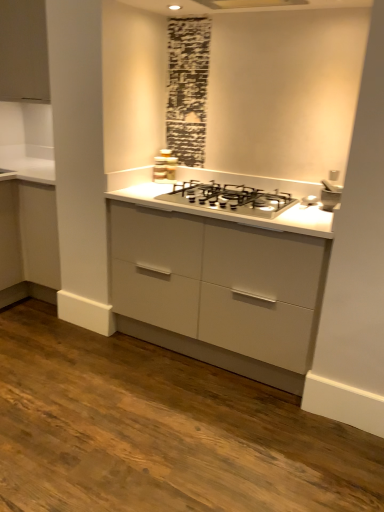
Question: Should I look upward or downward to see matte white cabinet at upper left?

Choices:
 (A) down
 (B) up

Answer: (B)

Question: Is satin silver gas stove at center with satin silver stove at center?

Choices:
 (A) yes
 (B) no

Answer: (B)

Question: From a real-world perspective, does satin silver gas stove at center sit lower than satin silver stove at center?

Choices:
 (A) yes
 (B) no

Answer: (A)

Question: Does satin silver gas stove at center have a larger size compared to satin silver stove at center?

Choices:
 (A) yes
 (B) no

Answer: (A)

Question: From a real-world perspective, is satin silver gas stove at center on satin silver stove at center?

Choices:
 (A) yes
 (B) no

Answer: (B)

Question: Is satin silver gas stove at center at the left side of satin silver stove at center?

Choices:
 (A) no
 (B) yes

Answer: (A)

Question: Is satin silver gas stove at center at the right side of satin silver stove at center?

Choices:
 (A) no
 (B) yes

Answer: (B)

Question: Considering the relative sizes of white ceramic sink at upper right and satin silver stove at center in the image provided, is white ceramic sink at upper right thinner than satin silver stove at center?

Choices:
 (A) no
 (B) yes

Answer: (A)

Question: Is white ceramic sink at upper right at the right side of satin silver stove at center?

Choices:
 (A) no
 (B) yes

Answer: (B)

Question: Is white ceramic sink at upper right outside satin silver stove at center?

Choices:
 (A) no
 (B) yes

Answer: (B)

Question: Could satin silver stove at center be considered to be inside white ceramic sink at upper right?

Choices:
 (A) no
 (B) yes

Answer: (A)

Question: From a real-world perspective, is white ceramic sink at upper right over satin silver stove at center?

Choices:
 (A) no
 (B) yes

Answer: (A)

Question: Is white ceramic sink at upper right taller than satin silver stove at center?

Choices:
 (A) yes
 (B) no

Answer: (B)

Question: Is white ceramic sink at upper right not within matte white cabinet at upper left?

Choices:
 (A) yes
 (B) no

Answer: (A)